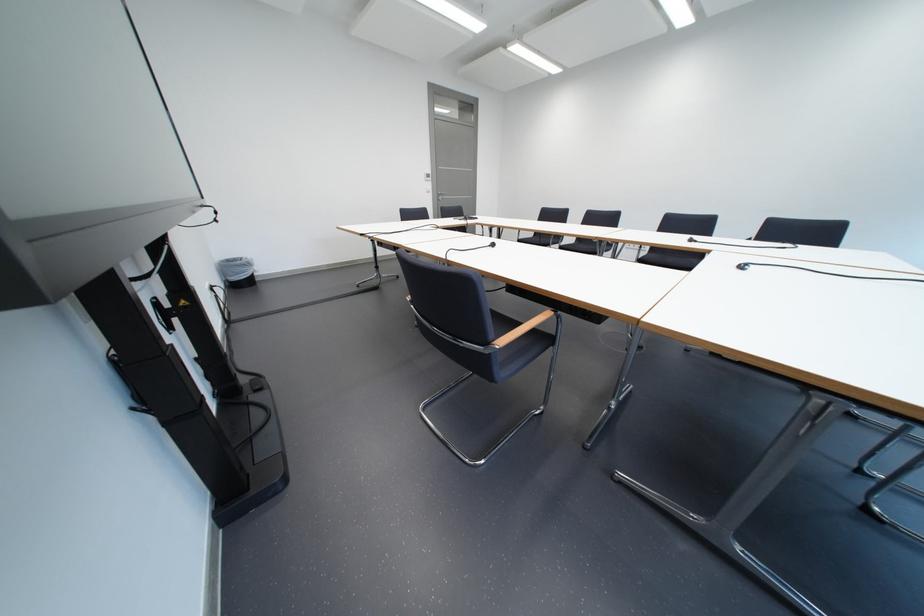
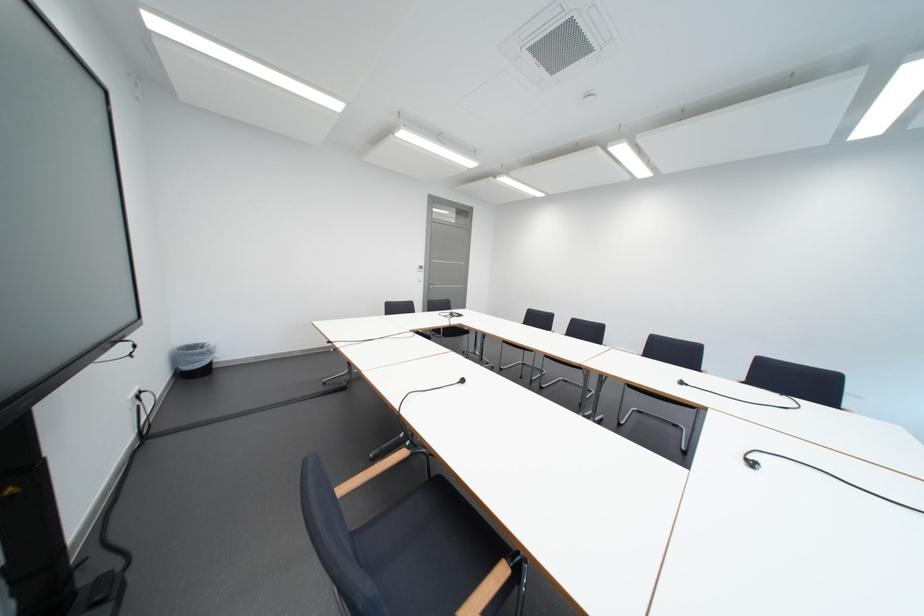
Question: The first image is from the beginning of the video and the second image is from the end. How did the camera likely rotate when shooting the video?

Choices:
 (A) Left
 (B) Right
 (C) Up
 (D) Down

Answer: (C)